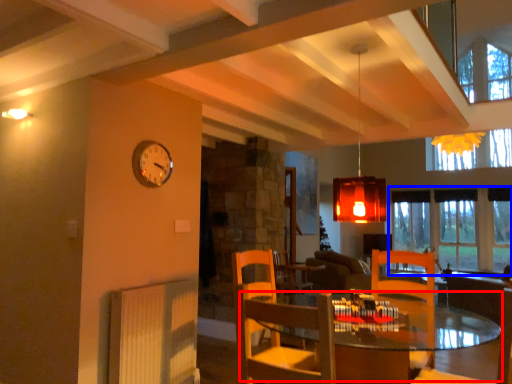
Question: Which point is closer to the camera, table (highlighted by a red box) or window (highlighted by a blue box)?

Choices:
 (A) table
 (B) window

Answer: (A)